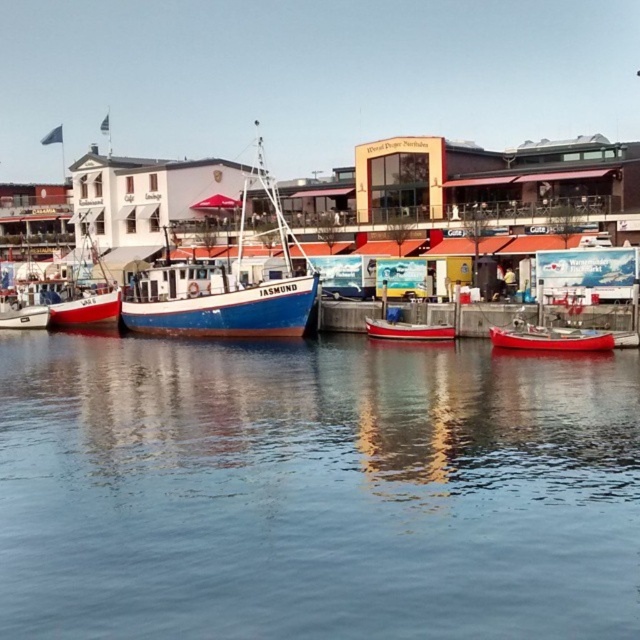
Question: Is red matte canoe at lower right wider than red matte boat at center?

Choices:
 (A) no
 (B) yes

Answer: (B)

Question: Which object is positioned closest to the transparent water at center?

Choices:
 (A) red matte canoe at lower right
 (B) blue matte boat at center

Answer: (A)

Question: Does blue matte boat at center have a greater width compared to matte blue boat at center?

Choices:
 (A) no
 (B) yes

Answer: (B)

Question: Among these objects, which one is farthest from the camera?

Choices:
 (A) transparent water at center
 (B) red matte boat at center

Answer: (B)

Question: Among these points, which one is farthest from the camera?

Choices:
 (A) (577, 330)
 (B) (253, 308)
 (C) (76, 298)
 (D) (484, 589)

Answer: (C)

Question: Is transparent water at center above red matte canoe at lower right?

Choices:
 (A) no
 (B) yes

Answer: (A)